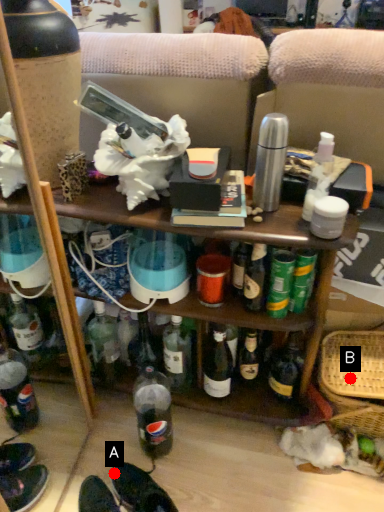
Question: Two points are circled on the image, labeled by A and B beside each circle. Which point is farther to the camera?

Choices:
 (A) A is further
 (B) B is further

Answer: (B)